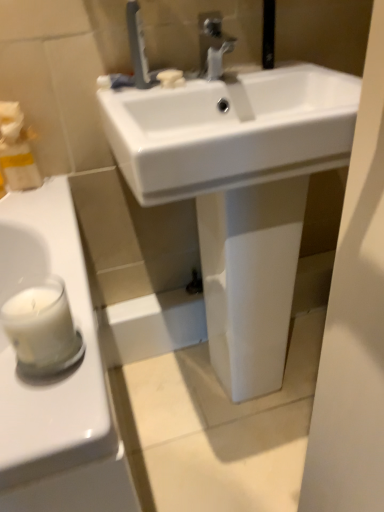
Question: Does point (205, 71) appear closer or farther from the camera than point (43, 276)?

Choices:
 (A) closer
 (B) farther

Answer: (B)

Question: From the image's perspective, relative to white wax candle at left, is matte silver faucet at upper center, which is the 1th tap in right-to-left order, above or below?

Choices:
 (A) below
 (B) above

Answer: (B)

Question: Which object is positioned closest to the white matte soap at center?

Choices:
 (A) matte silver faucet at upper center, which is the 1th tap in right-to-left order
 (B) white glossy sink at center
 (C) satin nickel faucet at upper center, the 1th tap positioned from the left
 (D) white wax candle at left

Answer: (C)

Question: Considering the real-world distances, which object is farthest from the white matte soap at center?

Choices:
 (A) white wax candle at left
 (B) matte silver faucet at upper center, acting as the second tap starting from the left
 (C) satin nickel faucet at upper center, which is the second tap from right to left
 (D) white glossy sink at center

Answer: (A)